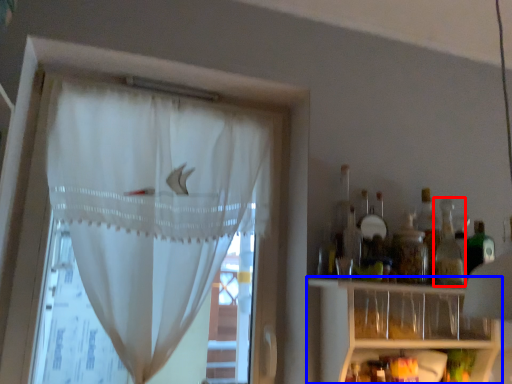
Question: Among these objects, which one is nearest to the camera, bottle (highlighted by a red box) or shelf (highlighted by a blue box)?

Choices:
 (A) bottle
 (B) shelf

Answer: (B)